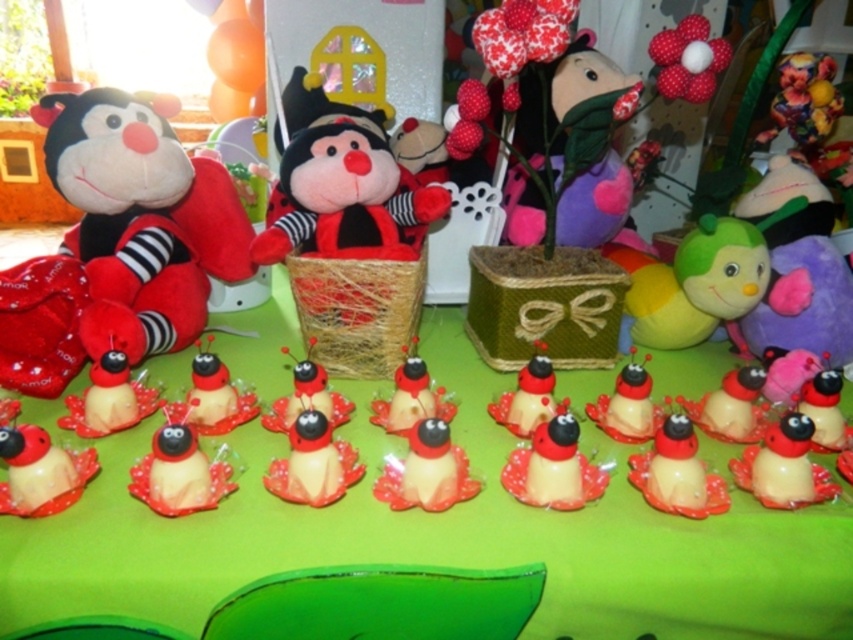
Does soft plush toy at left have a greater width compared to plush toy at center?

Yes, soft plush toy at left is wider than plush toy at center.

This screenshot has height=640, width=853. What are the coordinates of `soft plush toy at left` in the screenshot? It's located at (141, 218).

Is point (100, 282) more distant than point (288, 224)?

No, (100, 282) is in front of (288, 224).

Find the location of a particular element. soft plush toy at left is located at coordinates (141, 218).

Can you confirm if green matte table at center is positioned to the right of plush toy at center?

Yes, green matte table at center is to the right of plush toy at center.

Between green matte table at center and plush toy at center, which one appears on the left side from the viewer's perspective?

plush toy at center

The width and height of the screenshot is (853, 640). In order to click on green matte table at center in this screenshot , I will do `click(434, 531)`.

Is point (228, 352) in front of point (154, 352)?

That is False.

Is green matte table at center positioned at the back of soft plush toy at left?

No, it is not.

This screenshot has width=853, height=640. I want to click on green matte table at center, so [434, 531].